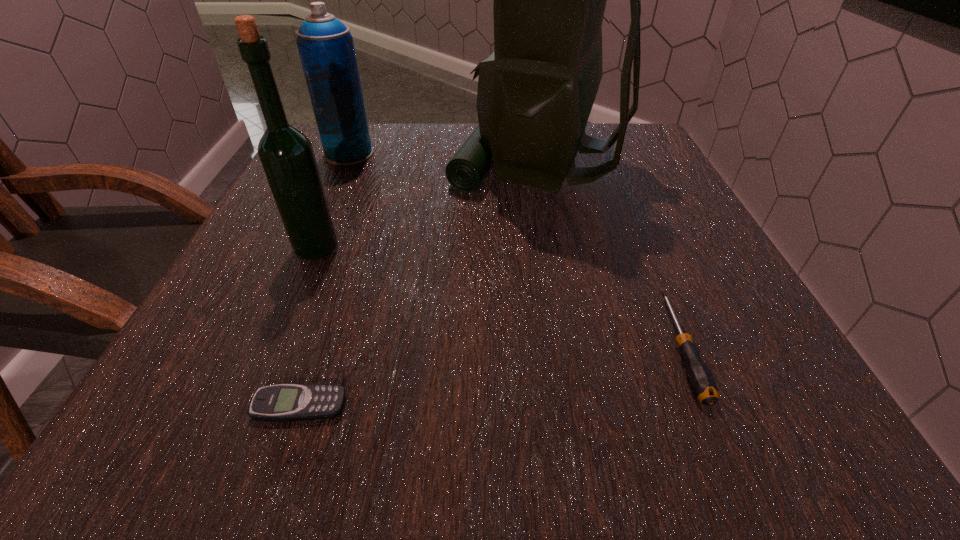
Identify the location of empty location between the aerosol can and the fourth tallest object. This screenshot has height=540, width=960. (515, 251).

Locate an element on the screen. The width and height of the screenshot is (960, 540). vacant area between the fourth tallest object and the third tallest object is located at coordinates (515, 251).

The width and height of the screenshot is (960, 540). What are the coordinates of `vacant space that is in between the backpack and the aerosol can` in the screenshot? It's located at coord(444,158).

Locate which object ranks fourth in proximity to the third nearest object. Please provide its 2D coordinates. Your answer should be formatted as a tuple, i.e. [(x, y)], where the tuple contains the x and y coordinates of a point satisfying the conditions above.

[(701, 380)]

At what (x,y) coordinates should I click in order to perform the action: click on object that stands as the second closest to the aerosol can. Please return your answer as a coordinate pair (x, y). Looking at the image, I should click on (287, 157).

This screenshot has height=540, width=960. I want to click on vacant area that satisfies the following two spatial constraints: 1. on the front of the backpack with visible pockets; 2. on the back side of the fourth tallest object, so click(573, 348).

Identify the location of free region that satisfies the following two spatial constraints: 1. on the front side of the shortest object; 2. on the left side of the third shortest object. This screenshot has width=960, height=540. point(235,406).

You are a GUI agent. You are given a task and a screenshot of the screen. Output one action in this format:
    pyautogui.click(x=<x>, y=<y>)
    Task: Click on the vacant space that satisfies the following two spatial constraints: 1. on the front of the screwdriver with visible pockets; 2. on the right side of the backpack
    
    Given the screenshot: What is the action you would take?
    pyautogui.click(x=573, y=348)

The height and width of the screenshot is (540, 960). I want to click on free point that satisfies the following two spatial constraints: 1. on the front of the second shortest object with visible pockets; 2. on the right side of the backpack, so click(x=573, y=348).